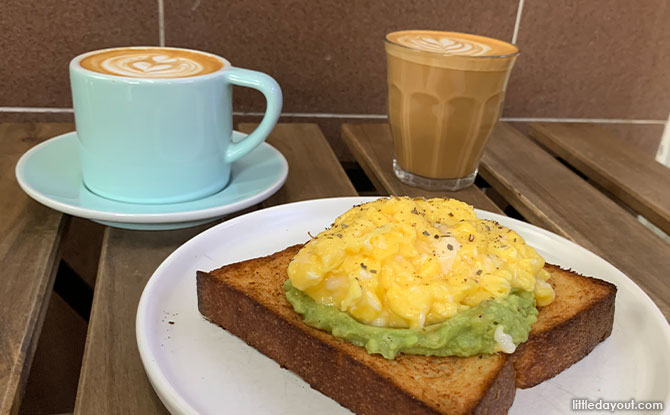
What are the coordinates of `place to hold coffee cup` in the screenshot? It's located at (268, 96).